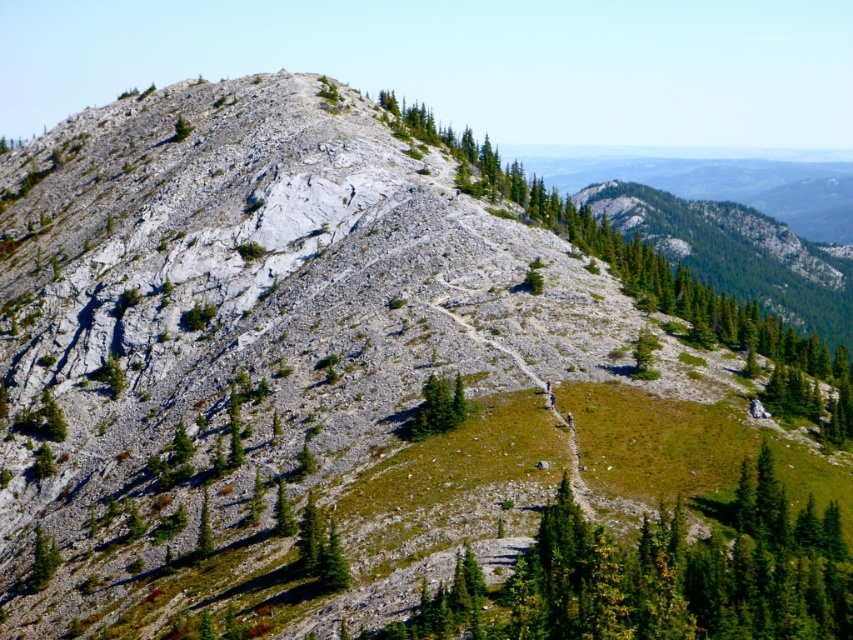
Can you confirm if green coniferous tree at center is bigger than green matte tree at center?

Yes.

This screenshot has width=853, height=640. Identify the location of green coniferous tree at center. (659, 577).

Is point (764, 342) less distant than point (416, 428)?

No, (764, 342) is behind (416, 428).

Does point (573, 221) come farther from viewer compared to point (440, 424)?

Yes, it is behind point (440, 424).

Locate an element on the screen. Image resolution: width=853 pixels, height=640 pixels. green leafy tree at center is located at coordinates (641, 266).

Who is positioned more to the left, green coniferous tree at center or green leafy tree at center?

green coniferous tree at center

Can you confirm if green coniferous tree at center is positioned to the left of green leafy tree at center?

Yes, green coniferous tree at center is to the left of green leafy tree at center.

Which is in front, point (442, 608) or point (564, 211)?

Point (442, 608) is in front.

You are a GUI agent. You are given a task and a screenshot of the screen. Output one action in this format:
    pyautogui.click(x=<x>, y=<y>)
    Task: Click on the green coniferous tree at center
    
    Given the screenshot: What is the action you would take?
    pyautogui.click(x=659, y=577)